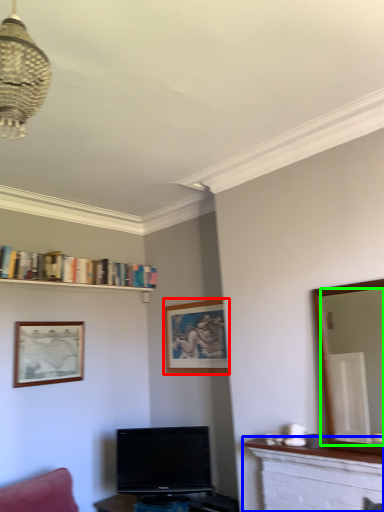
Question: Which object is the farthest from picture frame (highlighted by a red box)? Choose among these: fireplace (highlighted by a blue box) or mirror (highlighted by a green box).

Choices:
 (A) fireplace
 (B) mirror

Answer: (B)